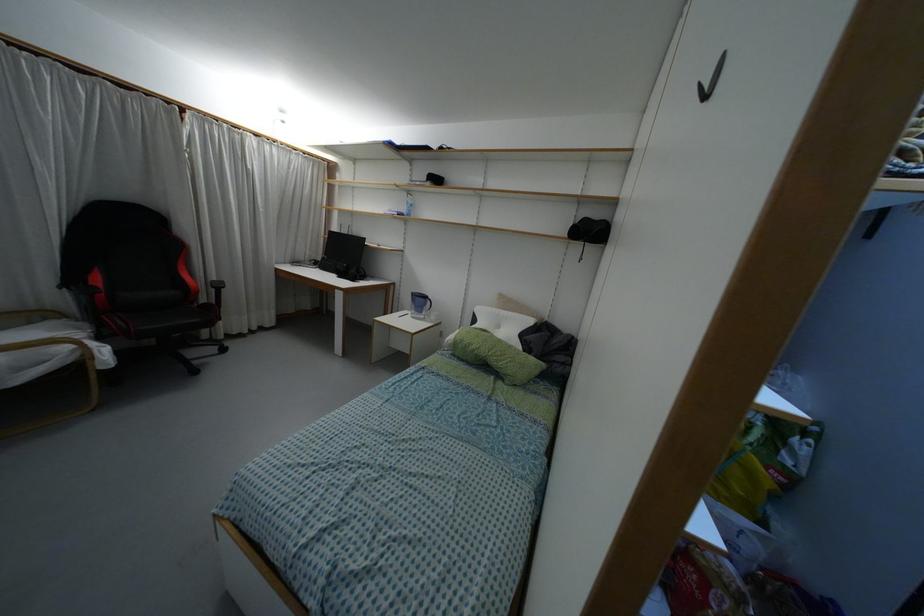
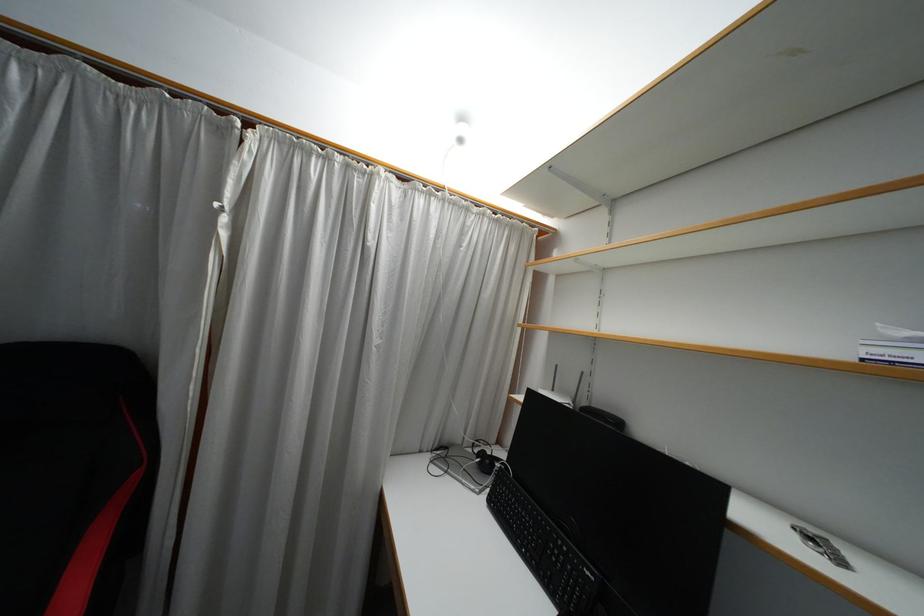
Find the pixel in the second image that matches point 283,122 in the first image.

(459, 140)